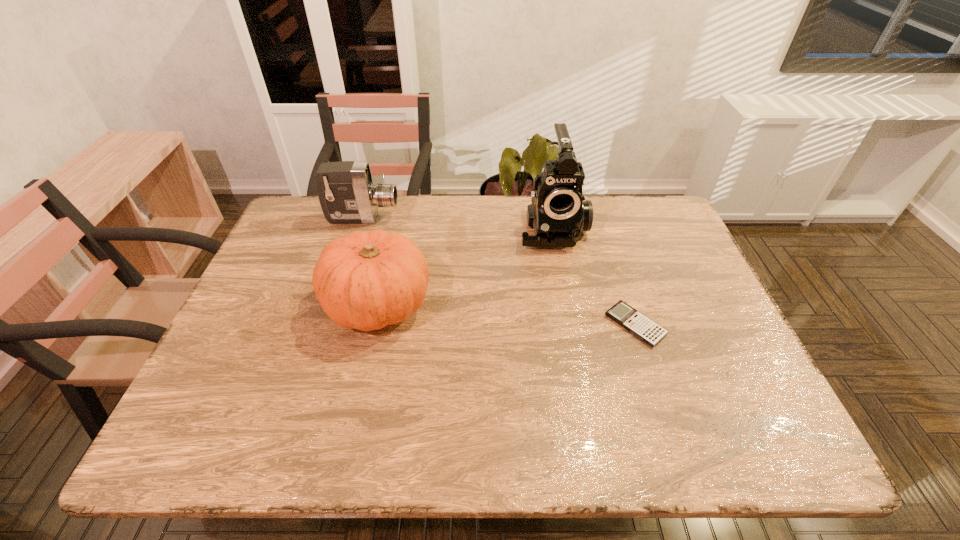
Identify the location of object present at the right edge. (648, 331).

You are a GUI agent. You are given a task and a screenshot of the screen. Output one action in this format:
    pyautogui.click(x=<x>, y=<y>)
    Task: Click on the object that is at the far left corner
    This screenshot has width=960, height=540.
    Given the screenshot: What is the action you would take?
    pyautogui.click(x=346, y=193)

The height and width of the screenshot is (540, 960). I want to click on vacant space at the far edge of the desktop, so click(517, 239).

Where is `vacant space at the near edge of the desktop`? The image size is (960, 540). vacant space at the near edge of the desktop is located at coordinates (517, 451).

You are a GUI agent. You are given a task and a screenshot of the screen. Output one action in this format:
    pyautogui.click(x=<x>, y=<y>)
    Task: Click on the free spot at the left edge of the desktop
    
    Given the screenshot: What is the action you would take?
    (260, 369)

Identify the location of vacant space at the right edge of the desktop. The width and height of the screenshot is (960, 540). (742, 396).

This screenshot has height=540, width=960. In the image, there is a desktop. Identify the location of vacant space at the far right corner. (640, 242).

This screenshot has width=960, height=540. I want to click on free space between the tallest object and the pumpkin, so click(x=466, y=266).

Where is `vacant area between the calculator and the taller camcorder`? Image resolution: width=960 pixels, height=540 pixels. vacant area between the calculator and the taller camcorder is located at coordinates (593, 276).

You are a GUI agent. You are given a task and a screenshot of the screen. Output one action in this format:
    pyautogui.click(x=<x>, y=<y>)
    Task: Click on the free space between the tallest object and the shortest object
    
    Given the screenshot: What is the action you would take?
    pyautogui.click(x=593, y=276)